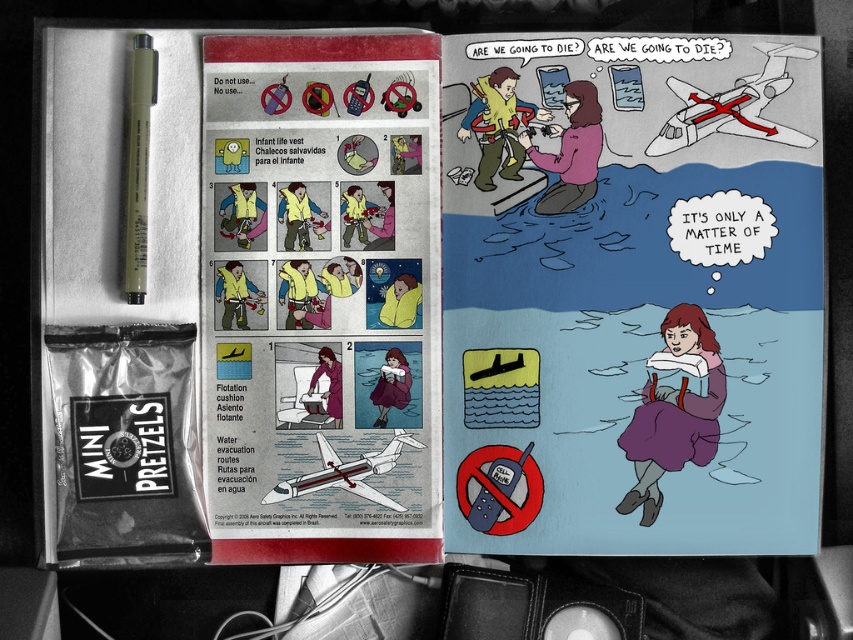
Between yellow paper at upper center and olive matte pen at upper left, which one appears on the right side from the viewer's perspective?

yellow paper at upper center is more to the right.

Is point (221, 49) positioned after point (149, 81)?

Yes, it is.

Identify the location of yellow paper at upper center. (321, 298).

Who is taller, yellow paper at upper center or purple fabric dress at lower center?

yellow paper at upper center is taller.

Who is shorter, yellow paper at upper center or purple fabric dress at lower center?

purple fabric dress at lower center

Describe the element at coordinates (321, 298) in the screenshot. I see `yellow paper at upper center` at that location.

Locate an element on the screen. Image resolution: width=853 pixels, height=640 pixels. yellow paper at upper center is located at coordinates (321, 298).

Looking at this image, can you confirm if purple fabric dress at lower center is positioned to the right of olive matte pen at upper left?

Yes, purple fabric dress at lower center is to the right of olive matte pen at upper left.

Who is higher up, purple fabric dress at lower center or olive matte pen at upper left?

olive matte pen at upper left is higher up.

Locate an element on the screen. purple fabric dress at lower center is located at coordinates (672, 413).

This screenshot has height=640, width=853. I want to click on purple fabric dress at lower center, so click(x=672, y=413).